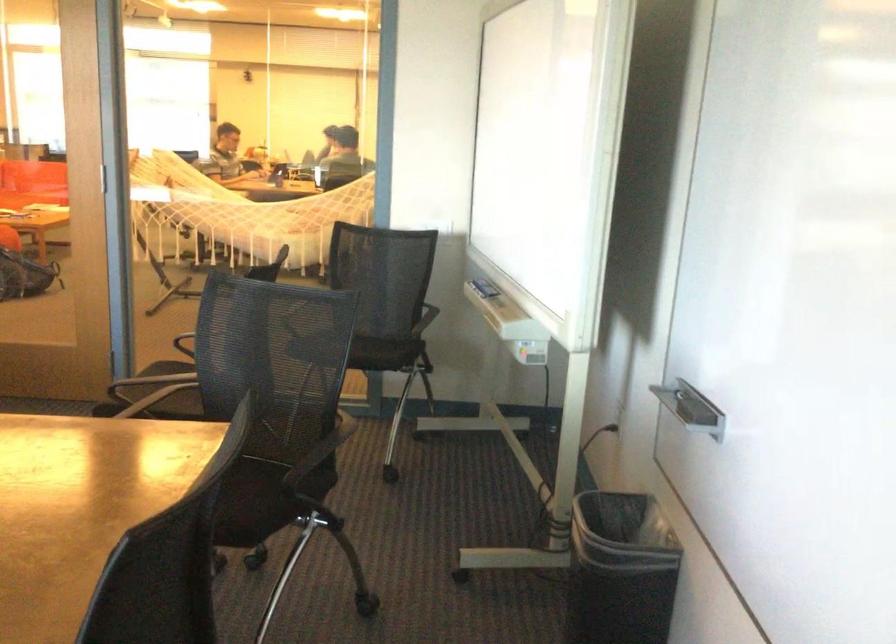
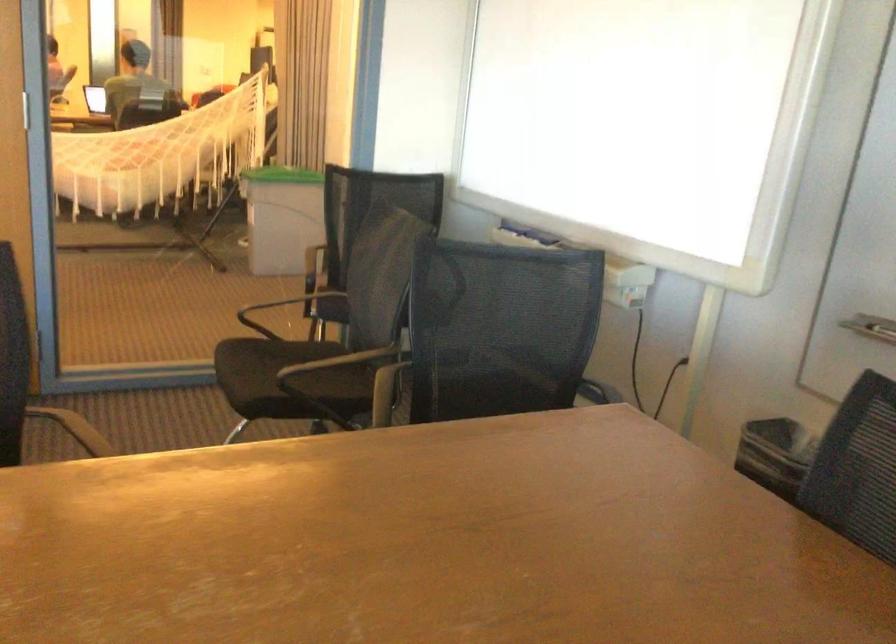
Find the pixel in the second image that matches point (276, 361) in the first image.

(501, 328)